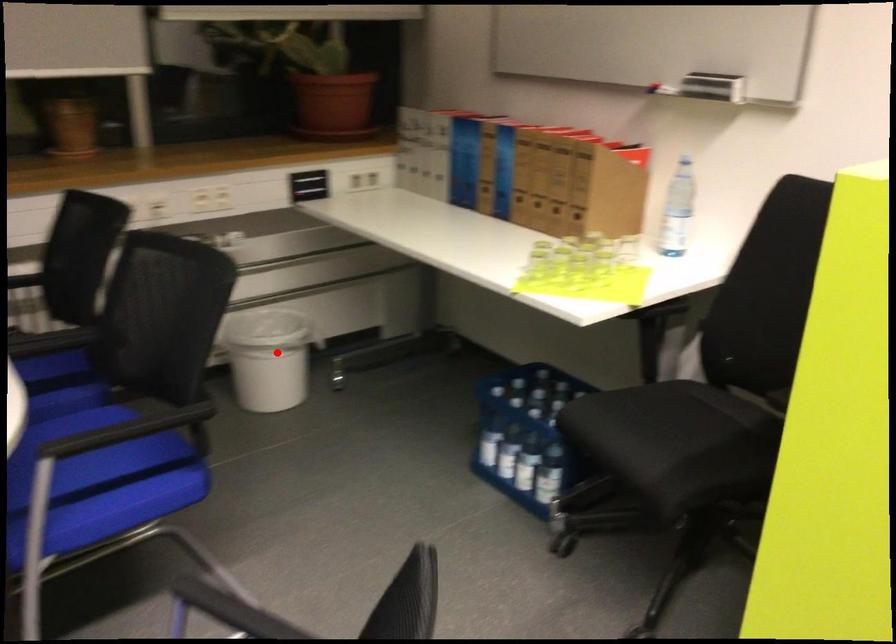
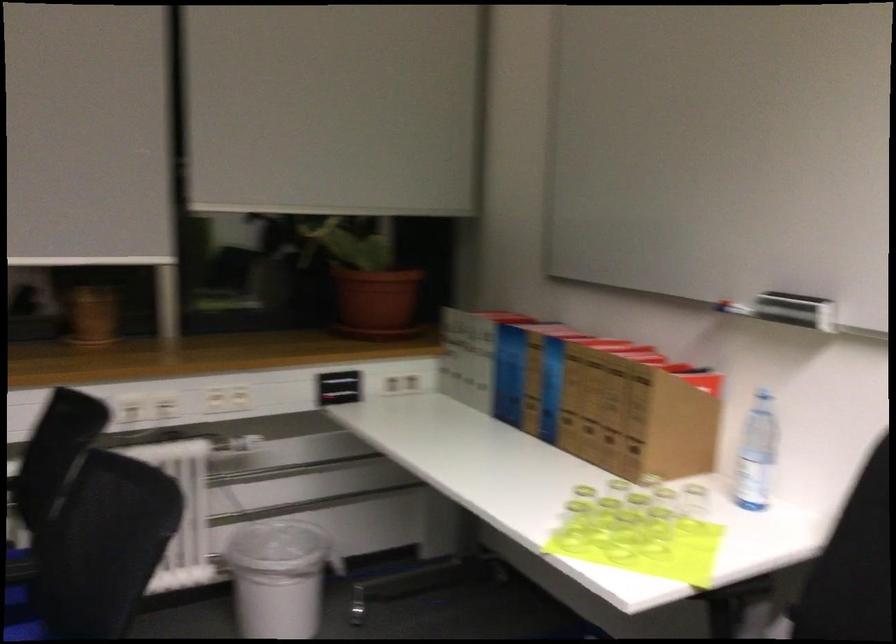
In the second image, find the point that corresponds to the highlighted location in the first image.

(278, 576)